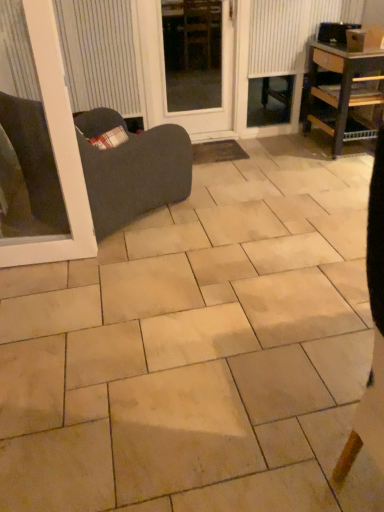
Question: Considering the positions of beige ceramic tile at center and matte white blind at upper left in the image, is beige ceramic tile at center wider or thinner than matte white blind at upper left?

Choices:
 (A) wide
 (B) thin

Answer: (A)

Question: Is beige ceramic tile at center taller or shorter than matte white blind at upper left?

Choices:
 (A) short
 (B) tall

Answer: (A)

Question: Estimate the real-world distances between objects in this image. Which object is closer to the wooden shelf at right?

Choices:
 (A) white textured radiator at upper right
 (B) brown woven mat at center
 (C) matte white blind at upper left
 (D) beige ceramic tile at center
 (E) transparent glass door at center

Answer: (A)

Question: Considering the real-world distances, which object is closest to the white textured radiator at upper right?

Choices:
 (A) transparent glass door at center
 (B) beige ceramic tile at center
 (C) wooden shelf at right
 (D) brown woven mat at center
 (E) matte white blind at upper left

Answer: (C)